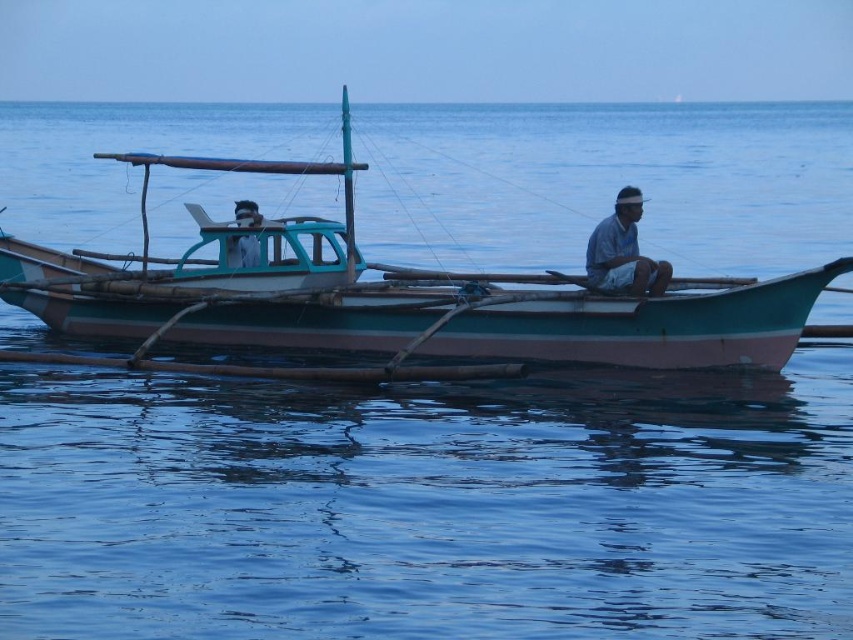
You are standing on the dock and want to reach the point marked as point (627, 227) on the fishing boat. The boat is 100 feet away from you. Can you safely walk to that point without getting into the water?

The distance of point (627, 227) from viewer is 99.29 feet, which is within the 100 feet distance of the boat. Therefore, you can safely walk to that point without getting into the water.

You are standing on the dock and see the teal wooden boat at center and the matte blue shirt at center in the image. Which object is higher in position?

The teal wooden boat at center is located above the matte blue shirt at center, so it is higher in position.

You are standing on the dock and want to board the teal wooden boat at center. However, there is a white woven hat at center in your path. Which object should you move first to reach the boat?

You should move the white woven hat at center first because the teal wooden boat at center is in front of it, meaning the hat is blocking your path to the boat.